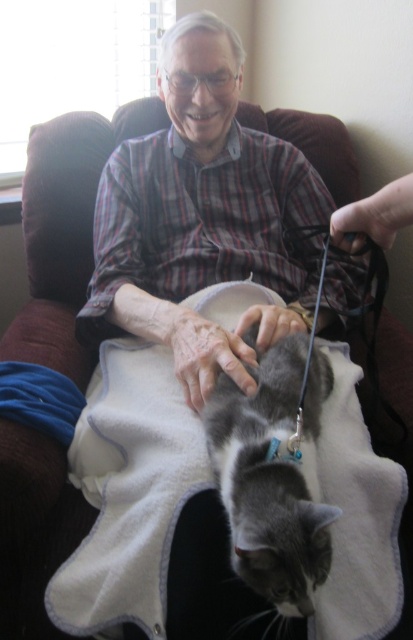
Question: Which object appears closest to the camera in this image?

Choices:
 (A) matte plaid shirt at center
 (B) gray fur cat at center

Answer: (B)

Question: Can you confirm if matte plaid shirt at center is positioned to the left of gray fur cat at center?

Choices:
 (A) yes
 (B) no

Answer: (A)

Question: Which object appears closest to the camera in this image?

Choices:
 (A) gray fur cat at center
 (B) matte plaid shirt at center

Answer: (A)

Question: Is matte plaid shirt at center wider than gray fur cat at center?

Choices:
 (A) no
 (B) yes

Answer: (B)

Question: Which of the following is the closest to the observer?

Choices:
 (A) matte plaid shirt at center
 (B) gray fur cat at center

Answer: (B)

Question: Does matte plaid shirt at center appear under gray fur cat at center?

Choices:
 (A) no
 (B) yes

Answer: (A)